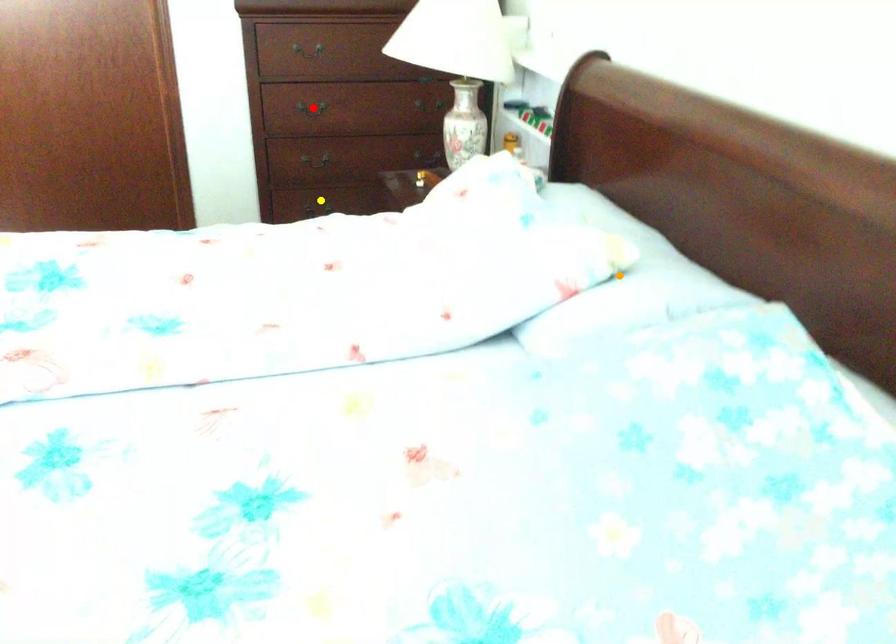
Order these from nearest to farthest:
- orange point
- red point
- yellow point

orange point, red point, yellow point